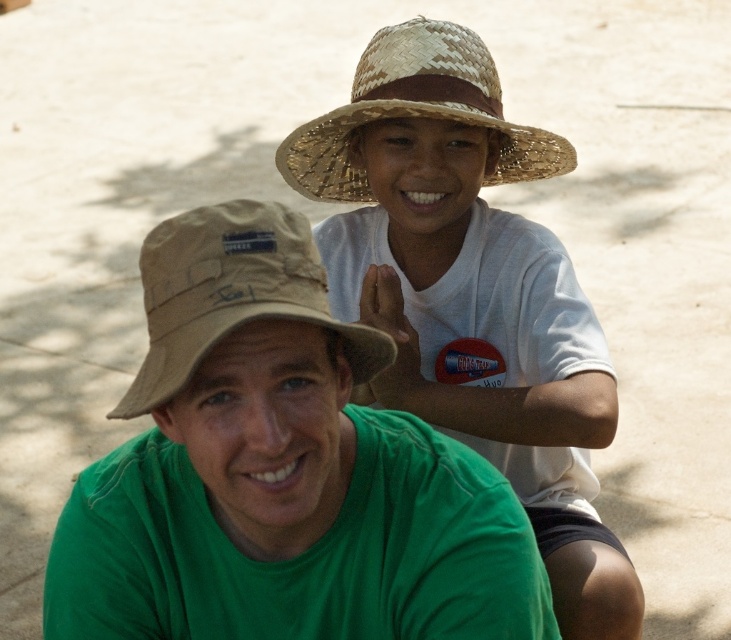
Question: Which of the following is the farthest from the observer?

Choices:
 (A) (80, 534)
 (B) (469, 164)
 (C) (401, 72)
 (D) (223, 282)

Answer: (B)

Question: Does straw hat at upper center appear on the right side of woven straw hat at upper center?

Choices:
 (A) yes
 (B) no

Answer: (B)

Question: Can you confirm if green cotton shirt at center is thinner than woven straw hat at upper center?

Choices:
 (A) no
 (B) yes

Answer: (A)

Question: Which object is farther from the camera taking this photo?

Choices:
 (A) straw hat at upper center
 (B) natural straw hat at upper center
 (C) green cotton shirt at center

Answer: (B)

Question: Among these objects, which one is nearest to the camera?

Choices:
 (A) woven straw hat at upper center
 (B) straw hat at upper center

Answer: (B)

Question: Does straw hat at upper center appear under woven straw hat at upper center?

Choices:
 (A) yes
 (B) no

Answer: (A)